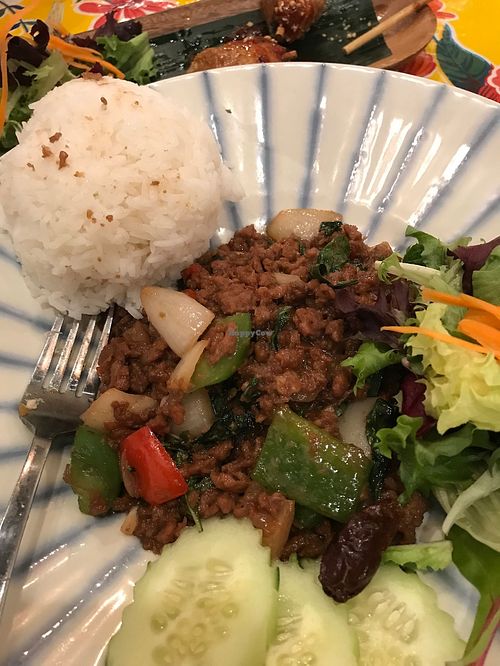
Find the location of a particular element. plate is located at coordinates (81, 565).